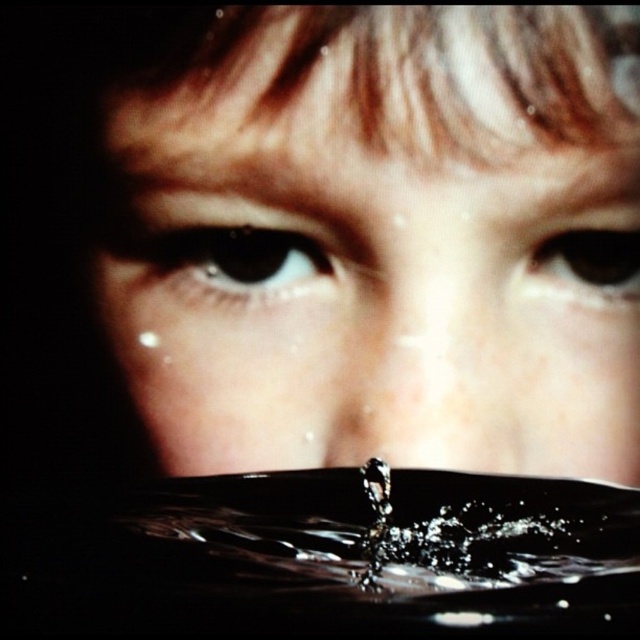
You are an artist trying to paint the scene. You notice two brown glossy eyes in the image. Which one appears closer to you, the brown glossy eye at center or the brown glossy eye at upper right?

The brown glossy eye at center appears closer to you because it is positioned in front of the brown glossy eye at upper right.